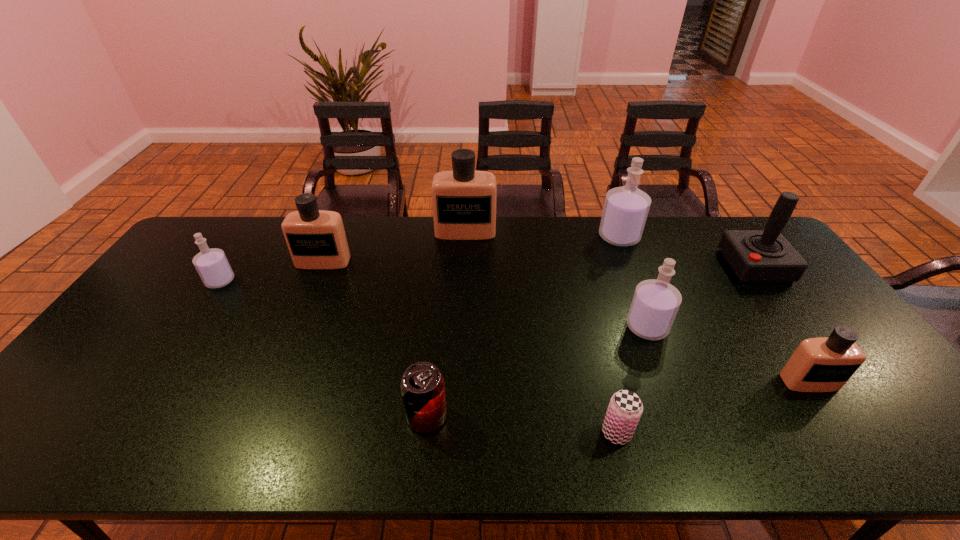
At what (x,y) coordinates should I click in order to perform the action: click on the closest purple perfume to the farthest purple perfume. Please return your answer as a coordinate pair (x, y). Looking at the image, I should click on (655, 303).

Locate which purple perfume is the closest to the red joystick. Please provide its 2D coordinates. Your answer should be formatted as a tuple, i.e. [(x, y)], where the tuple contains the x and y coordinates of a point satisfying the conditions above.

[(626, 208)]

Locate an element on the screen. beige perfume that is the second closest to the leftmost perfume is located at coordinates (464, 200).

Where is `the closest beige perfume to the second perfume from left to right`? The width and height of the screenshot is (960, 540). the closest beige perfume to the second perfume from left to right is located at coordinates (464, 200).

At what (x,y) coordinates should I click in order to perform the action: click on vacant space that satisfies the following two spatial constraints: 1. on the base of the joystick; 2. on the front side of the nearest purple perfume. Please return your answer as a coordinate pair (x, y). This screenshot has width=960, height=540. Looking at the image, I should click on (800, 327).